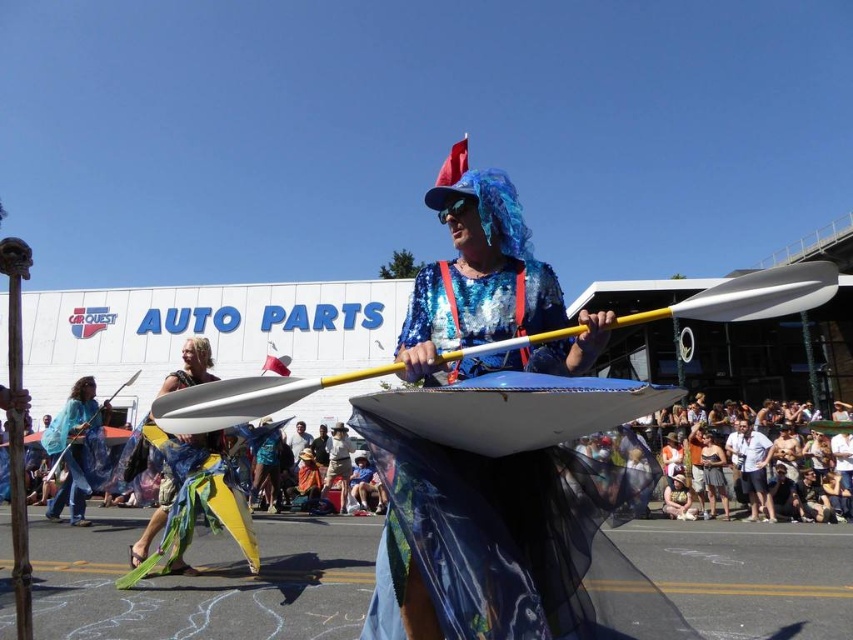
Who is lower down, metallic silver paddle at center or matte blue paddle at center?

Positioned lower is matte blue paddle at center.

Does metallic silver paddle at center have a greater height compared to matte blue paddle at center?

Incorrect, metallic silver paddle at center's height is not larger of matte blue paddle at center's.

Is point (386, 364) behind point (54, 468)?

Yes, point (386, 364) is farther from viewer.

Identify the location of metallic silver paddle at center. (752, 296).

Does yellow fabric at center lie behind blue fabric cape at left?

No, yellow fabric at center is in front of blue fabric cape at left.

Measure the distance from yellow fabric at center to blue fabric cape at left.

yellow fabric at center and blue fabric cape at left are 3.85 meters apart from each other.

I want to click on yellow fabric at center, so click(x=202, y=490).

Who is more distant from viewer, (204,424) or (241,492)?

Point (241,492)

Find the location of a particular element. metallic silver paddle at center is located at coordinates (752, 296).